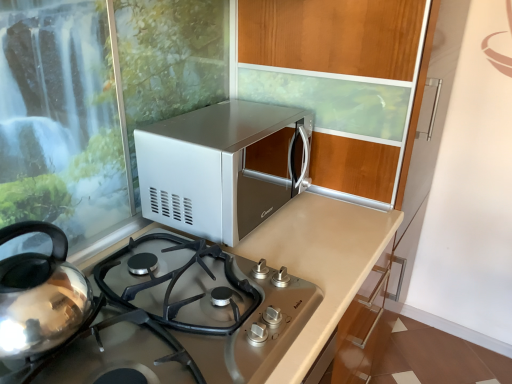
The width and height of the screenshot is (512, 384). What do you see at coordinates (320, 262) in the screenshot?
I see `satin silver gas stove at center` at bounding box center [320, 262].

You are a GUI agent. You are given a task and a screenshot of the screen. Output one action in this format:
    pyautogui.click(x=<x>, y=<y>)
    Task: Click on the satin silver gas stove at center
    The width and height of the screenshot is (512, 384).
    Given the screenshot: What is the action you would take?
    pyautogui.click(x=320, y=262)

Where is `satin silver microwave at upper center`? The height and width of the screenshot is (384, 512). satin silver microwave at upper center is located at coordinates (217, 168).

This screenshot has height=384, width=512. What do you see at coordinates (217, 168) in the screenshot?
I see `satin silver microwave at upper center` at bounding box center [217, 168].

Identify the location of satin silver gas stove at center. (320, 262).

Can you confirm if satin silver microwave at upper center is positioned to the left of satin silver gas stove at center?

No.

In the image, is satin silver microwave at upper center positioned in front of or behind satin silver gas stove at center?

satin silver microwave at upper center is behind satin silver gas stove at center.

Which is in front, point (250, 219) or point (318, 197)?

The point (250, 219) is closer to the camera.

From the image's perspective, would you say satin silver microwave at upper center is positioned over satin silver gas stove at center?

Yes, from the image's perspective, satin silver microwave at upper center is on top of satin silver gas stove at center.

From a real-world perspective, is satin silver microwave at upper center beneath satin silver gas stove at center?

No, from a real-world perspective, satin silver microwave at upper center is not beneath satin silver gas stove at center.

Which object is wider, satin silver microwave at upper center or satin silver gas stove at center?

With larger width is satin silver gas stove at center.

Between satin silver microwave at upper center and satin silver gas stove at center, which one has less height?

Standing shorter between the two is satin silver gas stove at center.

Which of these two, satin silver microwave at upper center or satin silver gas stove at center, is bigger?

With larger size is satin silver microwave at upper center.

Which is correct: satin silver microwave at upper center is inside satin silver gas stove at center, or outside of it?

satin silver microwave at upper center is not enclosed by satin silver gas stove at center.

Would you say satin silver microwave at upper center is a long distance from satin silver gas stove at center?

Actually, satin silver microwave at upper center and satin silver gas stove at center are a little close together.

Is satin silver microwave at upper center oriented away from satin silver gas stove at center?

No, satin silver microwave at upper center's orientation is not away from satin silver gas stove at center.

Find the location of `microwave oven on the right of satin silver gas stove at center`. microwave oven on the right of satin silver gas stove at center is located at coordinates point(217,168).

Does satin silver gas stove at center appear on the right side of satin silver microwave at upper center?

No.

Which object is further away from the camera taking this photo, satin silver gas stove at center or satin silver microwave at upper center?

satin silver microwave at upper center is behind.

Considering the positions of point (314, 325) and point (188, 198), is point (314, 325) closer or farther from the camera than point (188, 198)?

Clearly, point (314, 325) is closer to the camera than point (188, 198).

From the image's perspective, is satin silver gas stove at center located beneath satin silver microwave at upper center?

Yes, from the image's perspective, satin silver gas stove at center is below satin silver microwave at upper center.

From a real-world perspective, between satin silver gas stove at center and satin silver microwave at upper center, who is vertically lower?

satin silver gas stove at center, from a real-world perspective.

Does satin silver gas stove at center have a lesser width compared to satin silver microwave at upper center?

Incorrect, the width of satin silver gas stove at center is not less than that of satin silver microwave at upper center.

Can you confirm if satin silver gas stove at center is shorter than satin silver microwave at upper center?

Yes.

Considering the sizes of objects satin silver gas stove at center and satin silver microwave at upper center in the image provided, who is smaller, satin silver gas stove at center or satin silver microwave at upper center?

Smaller between the two is satin silver gas stove at center.

Looking at this image, is satin silver microwave at upper center a part of satin silver gas stove at center?

No, satin silver microwave at upper center is not surrounded by satin silver gas stove at center.

Would you consider satin silver gas stove at center to be distant from satin silver microwave at upper center?

No, satin silver gas stove at center is not far away from satin silver microwave at upper center.

Is satin silver gas stove at center aimed at satin silver microwave at upper center?

No, satin silver gas stove at center is not oriented towards satin silver microwave at upper center.

How far apart are satin silver gas stove at center and satin silver microwave at upper center?

A distance of 22.12 centimeters exists between satin silver gas stove at center and satin silver microwave at upper center.

The image size is (512, 384). What are the coordinates of `microwave oven behind the satin silver gas stove at center` in the screenshot? It's located at (217, 168).

I want to click on countertop that is under the satin silver microwave at upper center (from a real-world perspective), so click(320, 262).

This screenshot has width=512, height=384. I want to click on microwave oven on the right of the satin silver gas stove at center, so click(x=217, y=168).